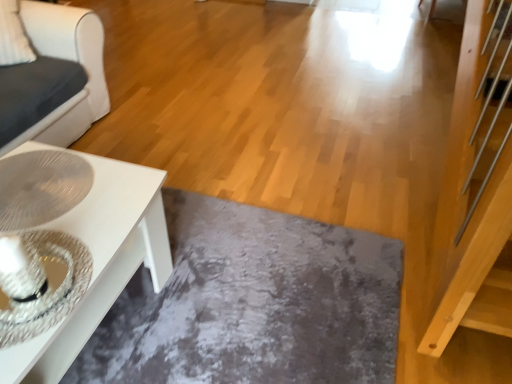
Question: In the image, is white glossy table at lower left positioned in front of or behind white glossy coffee table at lower left?

Choices:
 (A) front
 (B) behind

Answer: (A)

Question: Looking at their shapes, would you say white glossy table at lower left is wider or thinner than white glossy coffee table at lower left?

Choices:
 (A) thin
 (B) wide

Answer: (A)

Question: Considering the real-world distances, which object is farthest from the white glossy table at lower left?

Choices:
 (A) white glossy coffee table at lower left
 (B) slate at lower center

Answer: (A)

Question: Estimate the real-world distances between objects in this image. Which object is closer to the white glossy coffee table at lower left?

Choices:
 (A) white glossy table at lower left
 (B) slate at lower center

Answer: (A)